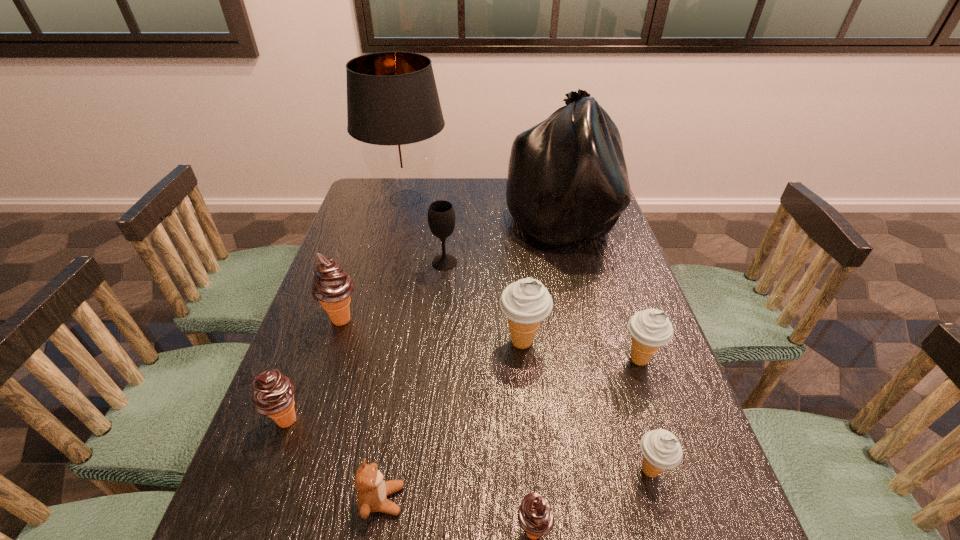
Where is `teddy bear`? The image size is (960, 540). teddy bear is located at coordinates (372, 493).

I want to click on vacant area situated 0.150m on the front of the gray lampshade, so click(x=393, y=250).

Locate an element on the screen. vacant space situated 0.330m on the left of the plastic bag is located at coordinates (407, 221).

The width and height of the screenshot is (960, 540). I want to click on vacant area situated on the back of the biggest beige icecream, so click(515, 263).

Find the location of `vacant region located 0.280m on the back of the farthest chocolate icecream`. vacant region located 0.280m on the back of the farthest chocolate icecream is located at coordinates (x=366, y=243).

The width and height of the screenshot is (960, 540). What are the coordinates of `blank space located 0.070m on the front of the wineglass` in the screenshot? It's located at (443, 287).

You are a GUI agent. You are given a task and a screenshot of the screen. Output one action in this format:
    pyautogui.click(x=<x>, y=<y>)
    Task: Click on the free space located on the front of the second biggest beige icecream
    This screenshot has width=960, height=540.
    Given the screenshot: What is the action you would take?
    pyautogui.click(x=684, y=488)

At what (x,y) coordinates should I click in order to perform the action: click on free location located 0.360m on the back of the second smallest chocolate icecream. Please return your answer as a coordinate pair (x, y). Looking at the image, I should click on (333, 291).

Identify the location of free region located on the left of the smallest beige icecream. (553, 471).

The image size is (960, 540). In order to click on vacant area situated on the front-facing side of the teddy bear in this screenshot , I will do `click(518, 500)`.